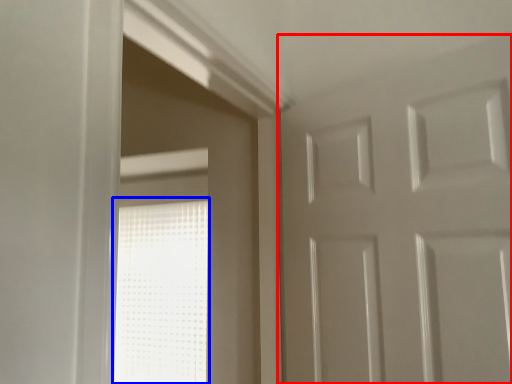
Question: Which object is closer to the camera taking this photo, door (highlighted by a red box) or window (highlighted by a blue box)?

Choices:
 (A) door
 (B) window

Answer: (A)